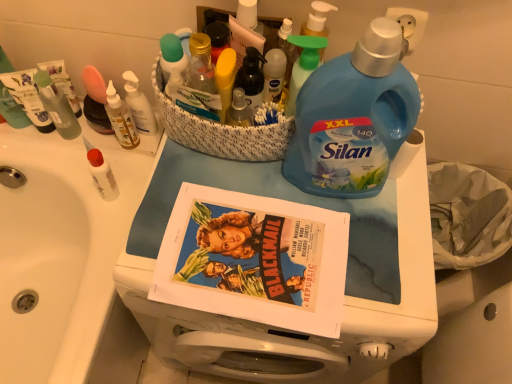
You are a GUI agent. You are given a task and a screenshot of the screen. Output one action in this format:
    pyautogui.click(x=<x>, y=<y>)
    Task: Click on the free space in front of translucent plastic bottles at upper left, which is the 2th toiletry from left to right
    The width and height of the screenshot is (512, 384).
    Given the screenshot: What is the action you would take?
    pos(115,185)